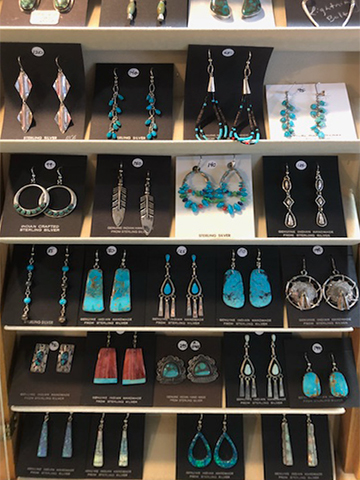
Locate an element on the screen. dream catcher is located at coordinates (306, 292), (340, 304).